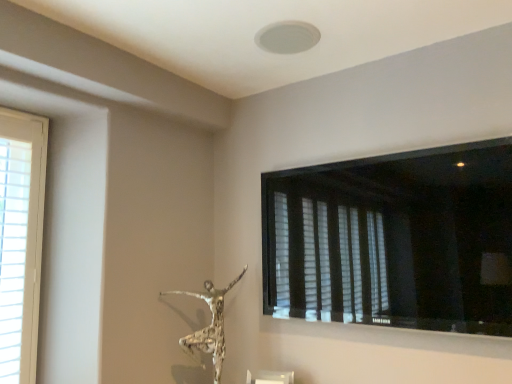
Question: Would you say silver textured sculpture at center is inside or outside black matte window at upper right, which appears as the 2th window when viewed from the left?

Choices:
 (A) inside
 (B) outside

Answer: (B)

Question: Considering the positions of point (202, 296) and point (498, 182), is point (202, 296) closer or farther from the camera than point (498, 182)?

Choices:
 (A) farther
 (B) closer

Answer: (A)

Question: Which object is the closest to the white wood window at left, which is counted as the 1th window, starting from the left?

Choices:
 (A) black matte window at upper right, which is counted as the 1th window, starting from the right
 (B) silver textured sculpture at center

Answer: (B)

Question: Which object is the farthest from the black matte window at upper right, which appears as the 2th window when viewed from the left?

Choices:
 (A) silver textured sculpture at center
 (B) white wood window at left, which is counted as the 1th window, starting from the left

Answer: (B)